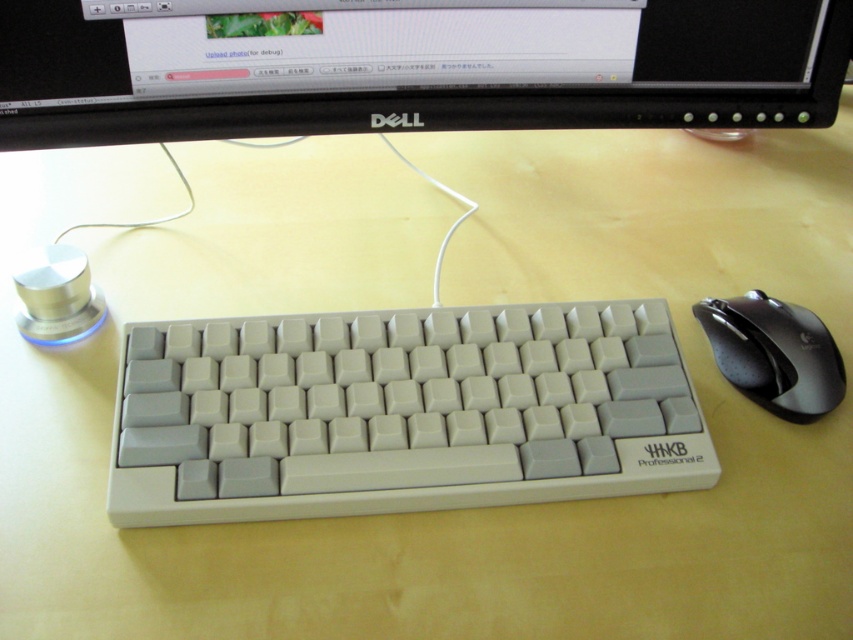
You are setting up a desk and want to place the white plastic keyboard at center and the black plastic monitor at upper center. Which object should you place first if you want the thinner item to be placed on top?

The white plastic keyboard at center is thinner than the black plastic monitor at upper center, so you should place the black plastic monitor at upper center first to have the thinner keyboard on top.

You are setting up a desk and need to place the white plastic keyboard at center and the black plastic monitor at upper center. Given that the desk has limited space, which object should you place first to ensure both fit properly?

Since the white plastic keyboard at center is smaller than the black plastic monitor at upper center, you should place the black plastic monitor at upper center first to ensure there is enough space for both items.

In the scene shown: You are setting up a new desk and need to place the black plastic monitor at upper center and the black plastic mouse at right. If the desk has limited vertical space, which object might you need to adjust the placement of first?

The black plastic monitor at upper center is taller than the black plastic mouse at right, so you should adjust the placement of the black plastic monitor at upper center first to accommodate the vertical space constraints.